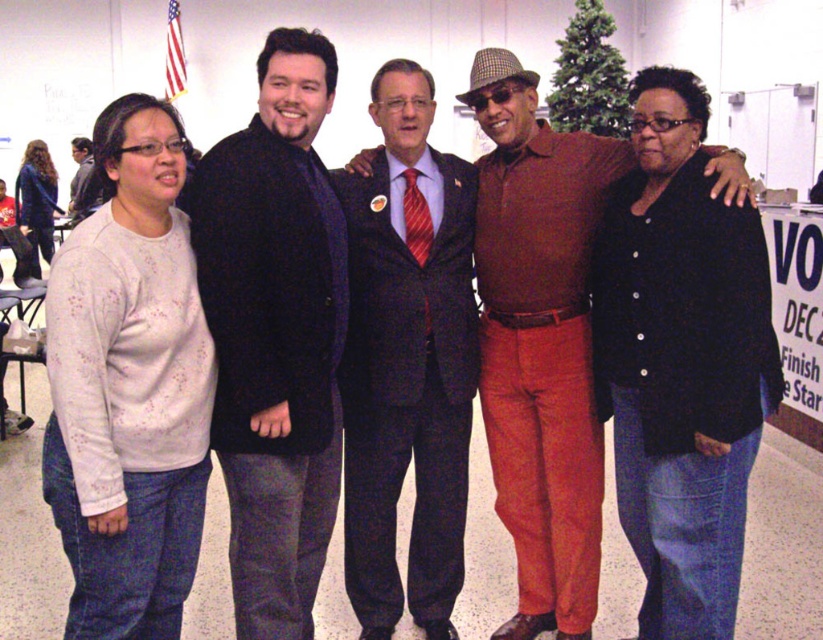
Question: Which object is farther from the camera taking this photo?

Choices:
 (A) matte black jacket at right
 (B) matte black sweater at left

Answer: (B)

Question: Among these objects, which one is nearest to the camera?

Choices:
 (A) dark blue suit at center
 (B) matte black sweater at left
 (C) matte white sweater at left
 (D) matte brown suit at center

Answer: (A)

Question: Can you confirm if matte black jacket at right is thinner than dark wool coat at center?

Choices:
 (A) yes
 (B) no

Answer: (B)

Question: Is dark wool coat at center wider than dark blue suit at center?

Choices:
 (A) no
 (B) yes

Answer: (A)

Question: Is the position of white speckled sweater at left less distant than that of dark wool coat at center?

Choices:
 (A) no
 (B) yes

Answer: (B)

Question: Among these objects, which one is nearest to the camera?

Choices:
 (A) matte black sweater at left
 (B) matte white sweater at left
 (C) matte black jacket at right
 (D) matte brown suit at center

Answer: (C)